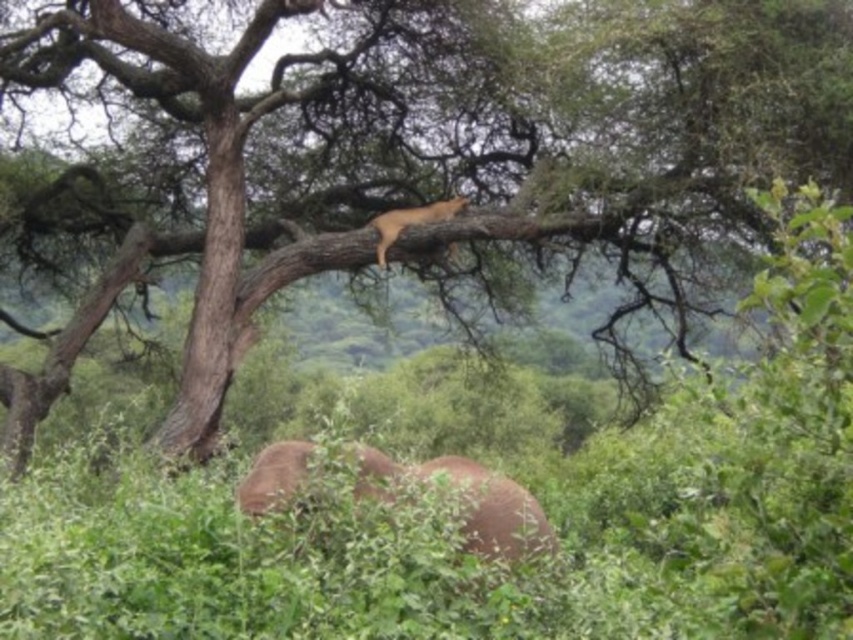
Does brown matte elephant at lower center have a smaller size compared to golden fur cat at upper center?

No.

Is brown matte elephant at lower center bigger than golden fur cat at upper center?

Indeed, brown matte elephant at lower center has a larger size compared to golden fur cat at upper center.

Locate an element on the screen. The height and width of the screenshot is (640, 853). brown matte elephant at lower center is located at coordinates (494, 508).